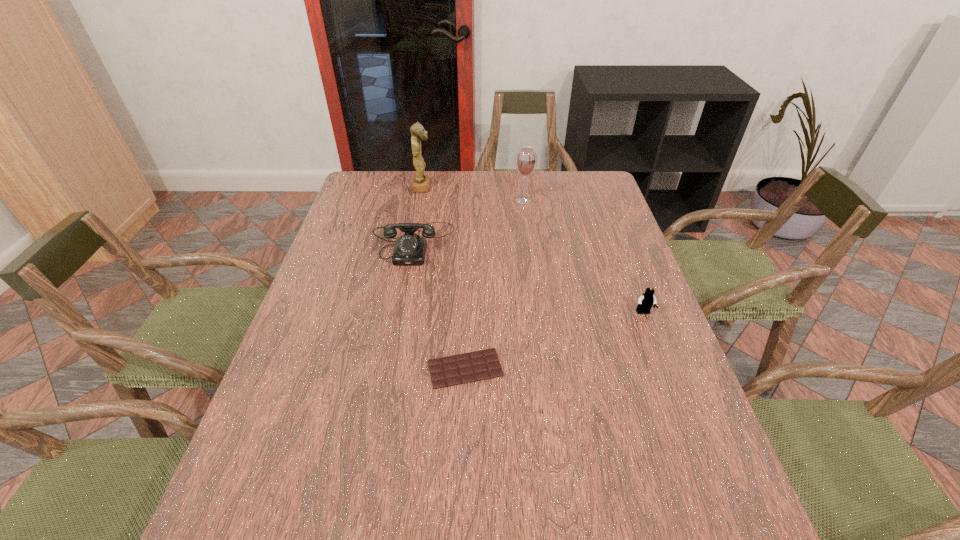
You are a GUI agent. You are given a task and a screenshot of the screen. Output one action in this format:
    pyautogui.click(x=<x>, y=<y>)
    Task: Click on the free space at the left edge
    
    Given the screenshot: What is the action you would take?
    pyautogui.click(x=375, y=224)

The height and width of the screenshot is (540, 960). Identify the location of vacant space at the right edge of the desktop. (588, 220).

Find the location of `free space at the far left corner of the desktop`. free space at the far left corner of the desktop is located at coordinates point(396,186).

At what (x,y) coordinates should I click in order to perform the action: click on free space at the far right corner of the desktop. Please return your answer as a coordinate pair (x, y). Looking at the image, I should click on (587, 181).

Where is `free space that is in between the figurine and the second nearest object`? The height and width of the screenshot is (540, 960). free space that is in between the figurine and the second nearest object is located at coordinates (533, 250).

In order to click on vacant space in between the second farthest object and the rightmost object in this screenshot , I will do `click(584, 256)`.

Locate an element on the screen. The height and width of the screenshot is (540, 960). empty space between the fourth object from left to right and the chocolate bar is located at coordinates (494, 284).

The width and height of the screenshot is (960, 540). What are the coordinates of `unoccupied area between the fourth farthest object and the telephone` in the screenshot? It's located at (529, 278).

Locate an element on the screen. Image resolution: width=960 pixels, height=540 pixels. free point between the fourth farthest object and the wineglass is located at coordinates (584, 256).

Find the location of a particular element. This screenshot has height=540, width=960. empty space that is in between the telephone and the Lego is located at coordinates tap(529, 278).